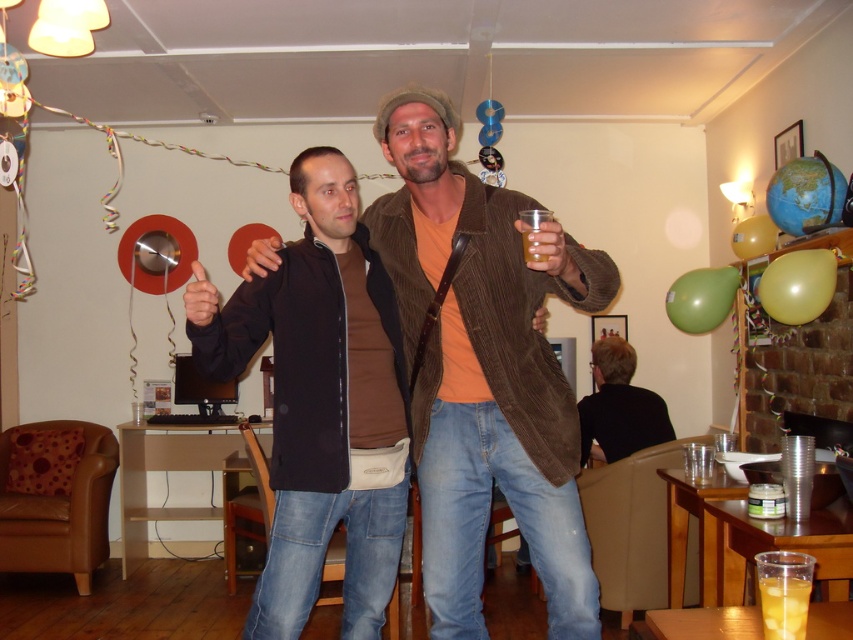
Question: Which point is farther from the camera taking this photo?

Choices:
 (A) (697, 323)
 (B) (747, 244)
 (C) (479, 118)

Answer: (C)

Question: Among these points, which one is nearest to the camera?

Choices:
 (A) pyautogui.click(x=489, y=102)
 (B) pyautogui.click(x=624, y=342)
 (C) pyautogui.click(x=706, y=285)

Answer: (C)

Question: Can you confirm if brown corduroy jacket at center is smaller than black fabric shirt at back?

Choices:
 (A) yes
 (B) no

Answer: (B)

Question: Which is nearer to the translucent plastic cup at lower right?

Choices:
 (A) matte black jacket at center
 (B) black fabric shirt at back
 (C) light yellow balloon at upper right

Answer: (A)

Question: Is black fabric shirt at back in front of light yellow rubber balloon at upper right?

Choices:
 (A) yes
 (B) no

Answer: (B)

Question: Can you confirm if brown corduroy jacket at center is bigger than light yellow rubber balloon at upper right?

Choices:
 (A) yes
 (B) no

Answer: (A)